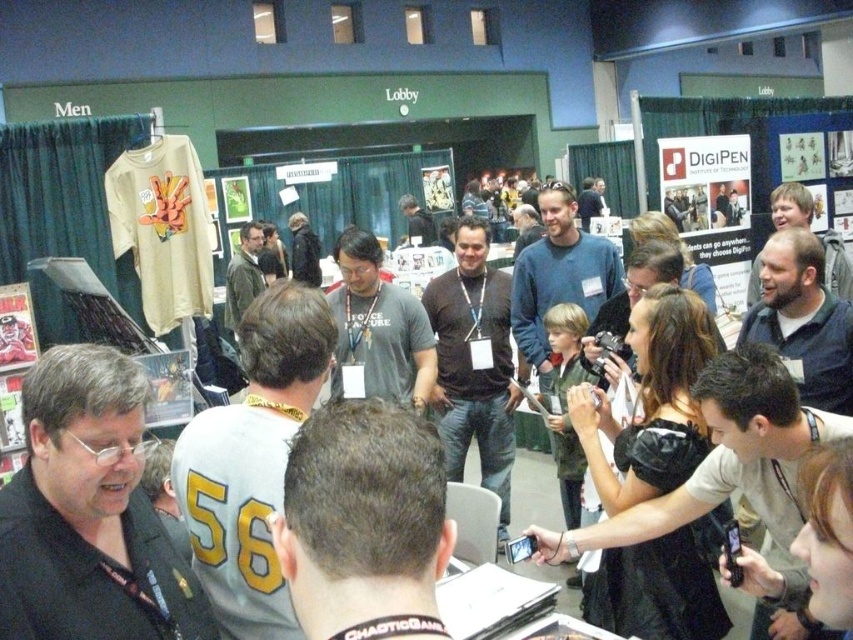
Does matte black jacket at left appear on the left side of blue sweater at center?

Yes, matte black jacket at left is to the left of blue sweater at center.

Who is more forward, (x=21, y=385) or (x=547, y=273)?

Point (x=21, y=385) is in front.

Identify the location of matte black jacket at left. (90, 513).

Is gray jersey at center below matte gray shirt at center?

Correct, gray jersey at center is located below matte gray shirt at center.

Looking at this image, can you confirm if gray jersey at center is wider than matte gray shirt at center?

No.

Where is `gray jersey at center`? gray jersey at center is located at coordinates [252, 461].

Identify the location of gray jersey at center. (252, 461).

In the scene shown: Does dark brown leather jacket at center have a larger size compared to brown cotton shirt at center?

Incorrect, dark brown leather jacket at center is not larger than brown cotton shirt at center.

Is dark brown leather jacket at center smaller than brown cotton shirt at center?

Yes.

Measure the distance between dark brown leather jacket at center and camera.

dark brown leather jacket at center and camera are 5.05 feet apart.

Image resolution: width=853 pixels, height=640 pixels. Identify the location of dark brown leather jacket at center. tap(730, 468).